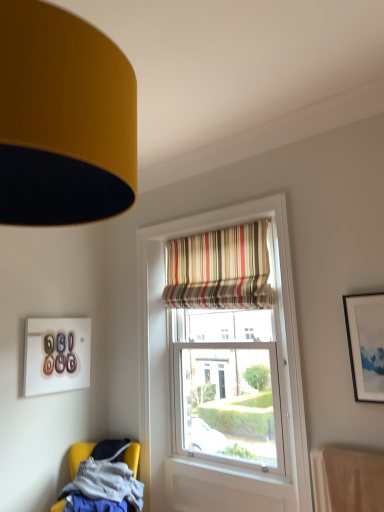
Where is `matte white picture frame at upper right, positioned as the 2th picture frame in left-to-right order`? This screenshot has width=384, height=512. matte white picture frame at upper right, positioned as the 2th picture frame in left-to-right order is located at coordinates (366, 344).

I want to click on matte glass picture frame at upper left, the 2th picture frame viewed from the right, so click(x=56, y=355).

The height and width of the screenshot is (512, 384). I want to click on yellow fabric chair at lower left, so click(x=79, y=455).

What's the angular difference between striped fabric curtain at upper center and matte white picture frame at upper right, the second picture frame when ordered from back to front,'s facing directions?

They differ by 0.158 degrees in their facing directions.

From a real-world perspective, is striped fabric curtain at upper center physically above matte white picture frame at upper right, the second picture frame when ordered from back to front?

Yes, from a real-world perspective, striped fabric curtain at upper center is on top of matte white picture frame at upper right, the second picture frame when ordered from back to front.

Which point is more distant from viewer, (x=233, y=297) or (x=351, y=333)?

The point (x=233, y=297) is more distant.

Is striped fabric curtain at upper center facing towards matte white picture frame at upper right, which is the 1th picture frame in right-to-left order?

No, striped fabric curtain at upper center does not turn towards matte white picture frame at upper right, which is the 1th picture frame in right-to-left order.

Is matte white picture frame at upper right, which is the 1th picture frame in right-to-left order, next to matte glass picture frame at upper left, the 2th picture frame viewed from the right, and touching it?

No, matte white picture frame at upper right, which is the 1th picture frame in right-to-left order, is not in contact with matte glass picture frame at upper left, the 2th picture frame viewed from the right.

Is point (361, 370) positioned before point (71, 376)?

Yes.

Looking at this image, from a real-world perspective, which is physically below, matte white picture frame at upper right, positioned as the first picture frame in front-to-back order, or matte glass picture frame at upper left, the second picture frame in the front-to-back sequence?

matte glass picture frame at upper left, the second picture frame in the front-to-back sequence, from a real-world perspective.

Considering the sizes of objects matte white picture frame at upper right, which is the 1th picture frame in right-to-left order, and matte glass picture frame at upper left, placed as the 1th picture frame when sorted from left to right, in the image provided, who is wider, matte white picture frame at upper right, which is the 1th picture frame in right-to-left order, or matte glass picture frame at upper left, placed as the 1th picture frame when sorted from left to right,?

Wider between the two is matte white picture frame at upper right, which is the 1th picture frame in right-to-left order.

Which object is more forward, yellow fabric chair at lower left or matte glass picture frame at upper left, the second picture frame in the front-to-back sequence?

yellow fabric chair at lower left is closer to the camera.

Considering the relative positions of yellow fabric chair at lower left and matte glass picture frame at upper left, the second picture frame in the front-to-back sequence, in the image provided, is yellow fabric chair at lower left to the right of matte glass picture frame at upper left, the second picture frame in the front-to-back sequence, from the viewer's perspective?

Indeed, yellow fabric chair at lower left is positioned on the right side of matte glass picture frame at upper left, the second picture frame in the front-to-back sequence.

Can we say yellow fabric chair at lower left lies outside matte glass picture frame at upper left, placed as the 1th picture frame when sorted from back to front?

yellow fabric chair at lower left lies outside matte glass picture frame at upper left, placed as the 1th picture frame when sorted from back to front,'s area.

Measure the distance from yellow fabric chair at lower left to matte white picture frame at upper right, positioned as the first picture frame in front-to-back order.

7.76 feet.

In the scene shown: From the image's perspective, which is above, yellow fabric chair at lower left or matte white picture frame at upper right, positioned as the first picture frame in front-to-back order?

matte white picture frame at upper right, positioned as the first picture frame in front-to-back order.

Based on the photo, considering the relative sizes of yellow fabric chair at lower left and matte white picture frame at upper right, the second picture frame when ordered from back to front, in the image provided, is yellow fabric chair at lower left bigger than matte white picture frame at upper right, the second picture frame when ordered from back to front,?

Yes.

Could you tell me if yellow fabric chair at lower left is turned towards matte white picture frame at upper right, the second picture frame when ordered from back to front?

No, yellow fabric chair at lower left is not turned towards matte white picture frame at upper right, the second picture frame when ordered from back to front.

Could you tell me if yellow fabric chair at lower left is turned towards striped fabric curtain at upper center?

No, yellow fabric chair at lower left is not facing towards striped fabric curtain at upper center.

From a real-world perspective, which object rests below the other?

yellow fabric chair at lower left, from a real-world perspective.

Does yellow fabric chair at lower left have a greater width compared to striped fabric curtain at upper center?

Correct, the width of yellow fabric chair at lower left exceeds that of striped fabric curtain at upper center.

Which is in front, matte glass picture frame at upper left, the 2th picture frame viewed from the right, or matte white picture frame at upper right, which is the 1th picture frame in right-to-left order?

matte white picture frame at upper right, which is the 1th picture frame in right-to-left order, is in front.

Considering the sizes of objects matte glass picture frame at upper left, the second picture frame in the front-to-back sequence, and matte white picture frame at upper right, which is the 1th picture frame in right-to-left order, in the image provided, who is wider, matte glass picture frame at upper left, the second picture frame in the front-to-back sequence, or matte white picture frame at upper right, which is the 1th picture frame in right-to-left order,?

matte white picture frame at upper right, which is the 1th picture frame in right-to-left order, is wider.

Is matte white picture frame at upper right, positioned as the 2th picture frame in left-to-right order, a part of matte glass picture frame at upper left, the 2th picture frame viewed from the right?

No, matte white picture frame at upper right, positioned as the 2th picture frame in left-to-right order, is not a part of matte glass picture frame at upper left, the 2th picture frame viewed from the right.

Considering the relative sizes of matte glass picture frame at upper left, placed as the 1th picture frame when sorted from left to right, and matte white picture frame at upper right, which is the 1th picture frame in right-to-left order, in the image provided, is matte glass picture frame at upper left, placed as the 1th picture frame when sorted from left to right, taller than matte white picture frame at upper right, which is the 1th picture frame in right-to-left order,?

In fact, matte glass picture frame at upper left, placed as the 1th picture frame when sorted from left to right, may be shorter than matte white picture frame at upper right, which is the 1th picture frame in right-to-left order.

Considering the sizes of objects matte glass picture frame at upper left, the second picture frame in the front-to-back sequence, and yellow fabric chair at lower left in the image provided, who is thinner, matte glass picture frame at upper left, the second picture frame in the front-to-back sequence, or yellow fabric chair at lower left?

matte glass picture frame at upper left, the second picture frame in the front-to-back sequence.

Would you say matte glass picture frame at upper left, placed as the 1th picture frame when sorted from back to front, contains yellow fabric chair at lower left?

Actually, yellow fabric chair at lower left is outside matte glass picture frame at upper left, placed as the 1th picture frame when sorted from back to front.

Does matte glass picture frame at upper left, the 2th picture frame viewed from the right, turn towards yellow fabric chair at lower left?

No.

Identify the location of picture frame lying in front of the striped fabric curtain at upper center. (366, 344).

Image resolution: width=384 pixels, height=512 pixels. Find the location of `picture frame behind the matte white picture frame at upper right, positioned as the 2th picture frame in left-to-right order`. picture frame behind the matte white picture frame at upper right, positioned as the 2th picture frame in left-to-right order is located at coordinates (56, 355).

Estimate the real-world distances between objects in this image. Which object is further from striped fabric curtain at upper center, yellow fabric chair at lower left or matte white picture frame at upper right, which is the 1th picture frame in right-to-left order?

Based on the image, yellow fabric chair at lower left appears to be further to striped fabric curtain at upper center.

When comparing their distances from matte glass picture frame at upper left, placed as the 1th picture frame when sorted from left to right, does yellow fabric chair at lower left or matte white picture frame at upper right, positioned as the 2th picture frame in left-to-right order, seem closer?

Based on the image, yellow fabric chair at lower left appears to be nearer to matte glass picture frame at upper left, placed as the 1th picture frame when sorted from left to right.

From the image, which object appears to be farther from yellow fabric chair at lower left, matte white picture frame at upper right, positioned as the first picture frame in front-to-back order, or matte glass picture frame at upper left, placed as the 1th picture frame when sorted from left to right?

Among the two, matte white picture frame at upper right, positioned as the first picture frame in front-to-back order, is located further to yellow fabric chair at lower left.

Based on their spatial positions, is yellow fabric chair at lower left or striped fabric curtain at upper center closer to matte white picture frame at upper right, positioned as the 2th picture frame in left-to-right order?

striped fabric curtain at upper center is closer to matte white picture frame at upper right, positioned as the 2th picture frame in left-to-right order.

Which object lies nearer to the anchor point striped fabric curtain at upper center, matte glass picture frame at upper left, placed as the 1th picture frame when sorted from back to front, or matte white picture frame at upper right, positioned as the first picture frame in front-to-back order?

matte white picture frame at upper right, positioned as the first picture frame in front-to-back order, is closer to striped fabric curtain at upper center.

Based on their spatial positions, is yellow fabric chair at lower left or matte glass picture frame at upper left, placed as the 1th picture frame when sorted from left to right, further from striped fabric curtain at upper center?

yellow fabric chair at lower left is positioned further to the anchor striped fabric curtain at upper center.

Based on their spatial positions, is matte glass picture frame at upper left, the second picture frame in the front-to-back sequence, or striped fabric curtain at upper center further from matte white picture frame at upper right, which is the 1th picture frame in right-to-left order?

matte glass picture frame at upper left, the second picture frame in the front-to-back sequence, is further to matte white picture frame at upper right, which is the 1th picture frame in right-to-left order.

Looking at the image, which one is located further to yellow fabric chair at lower left, striped fabric curtain at upper center or matte glass picture frame at upper left, the 2th picture frame viewed from the right?

striped fabric curtain at upper center is positioned further to the anchor yellow fabric chair at lower left.

Find the location of a particular element. chair between matte glass picture frame at upper left, placed as the 1th picture frame when sorted from back to front, and matte white picture frame at upper right, positioned as the first picture frame in front-to-back order, in the horizontal direction is located at coordinates pos(79,455).

Image resolution: width=384 pixels, height=512 pixels. In order to click on curtain between matte glass picture frame at upper left, placed as the 1th picture frame when sorted from left to right, and matte white picture frame at upper right, the second picture frame when ordered from back to front in this screenshot , I will do `click(220, 269)`.